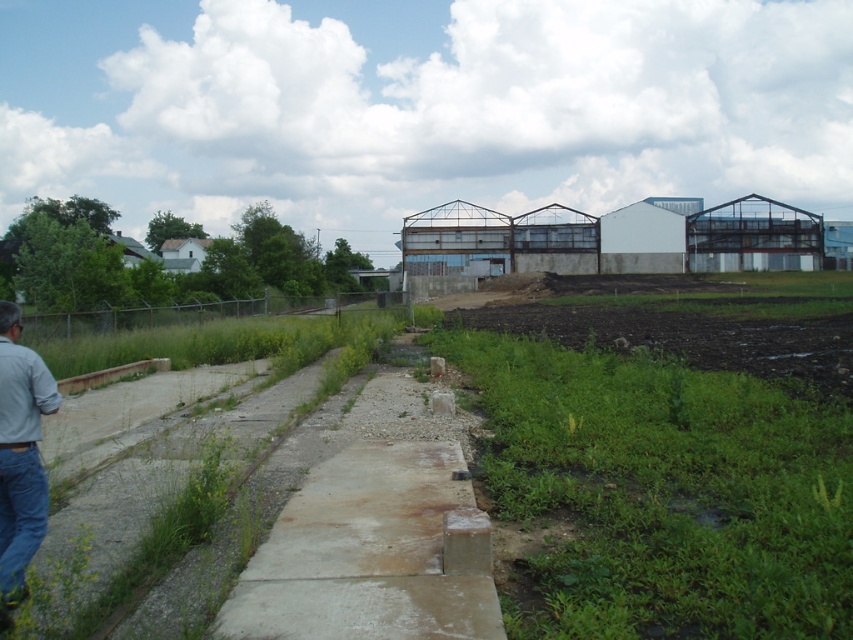
Is concrete at center in front of blue denim jeans at lower left?

No, concrete at center is further to the viewer.

Who is taller, concrete at center or blue denim jeans at lower left?

With more height is blue denim jeans at lower left.

Where is `concrete at center`? This screenshot has width=853, height=640. concrete at center is located at coordinates (374, 540).

Is green grassy field at center-right above blue denim jeans at lower left?

Yes, green grassy field at center-right is above blue denim jeans at lower left.

In the scene shown: Who is positioned more to the left, green grassy field at center-right or blue denim jeans at lower left?

blue denim jeans at lower left

At what (x,y) coordinates should I click in order to perform the action: click on green grassy field at center-right. Please return your answer as a coordinate pair (x, y). The height and width of the screenshot is (640, 853). Looking at the image, I should click on (663, 461).

From the picture: Between concrete at center and denim at left, which one appears on the right side from the viewer's perspective?

concrete at center is more to the right.

The image size is (853, 640). What do you see at coordinates (374, 540) in the screenshot?
I see `concrete at center` at bounding box center [374, 540].

Identify the location of concrete at center. The width and height of the screenshot is (853, 640). (374, 540).